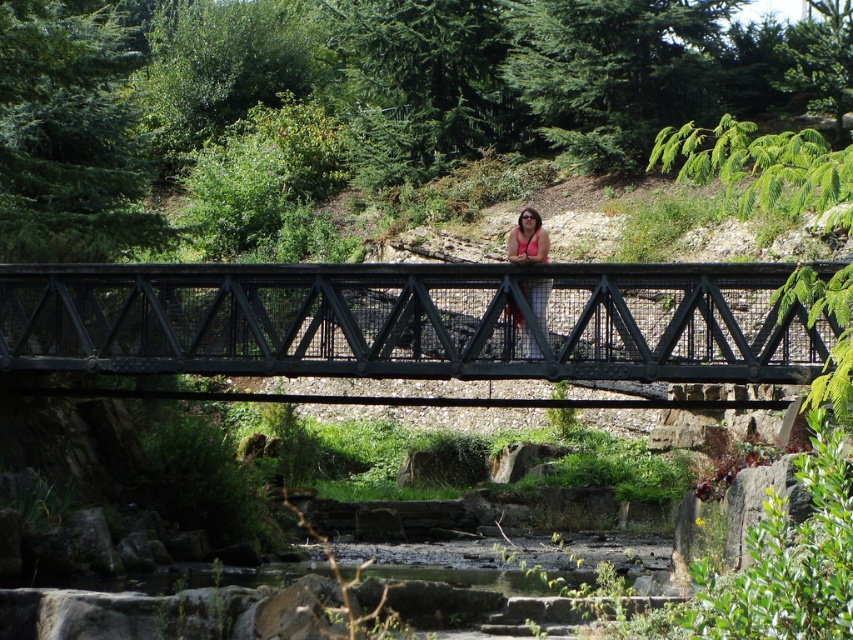
Question: Which point is farther to the camera?

Choices:
 (A) pink fabric at center
 (B) black metal footbridge at center

Answer: (A)

Question: Which of the following is the farthest from the observer?

Choices:
 (A) black metal footbridge at center
 (B) pink fabric at center

Answer: (B)

Question: Is black metal footbridge at center closer to camera compared to pink fabric at center?

Choices:
 (A) yes
 (B) no

Answer: (A)

Question: Does black metal footbridge at center have a smaller size compared to pink fabric at center?

Choices:
 (A) yes
 (B) no

Answer: (B)

Question: Which object appears closest to the camera in this image?

Choices:
 (A) pink fabric at center
 (B) black metal footbridge at center

Answer: (B)

Question: Does black metal footbridge at center appear on the right side of pink fabric at center?

Choices:
 (A) no
 (B) yes

Answer: (B)